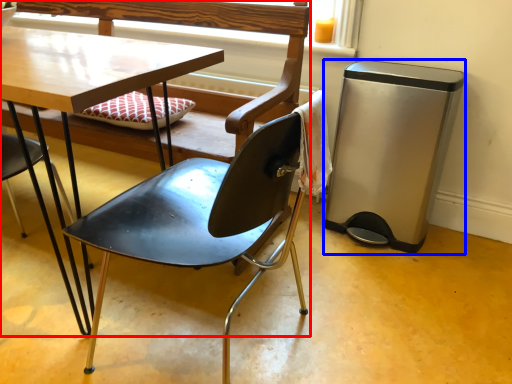
Question: Which of the following is the closest to the observer, chair (highlighted by a red box) or trash bin/can (highlighted by a blue box)?

Choices:
 (A) chair
 (B) trash bin/can

Answer: (A)